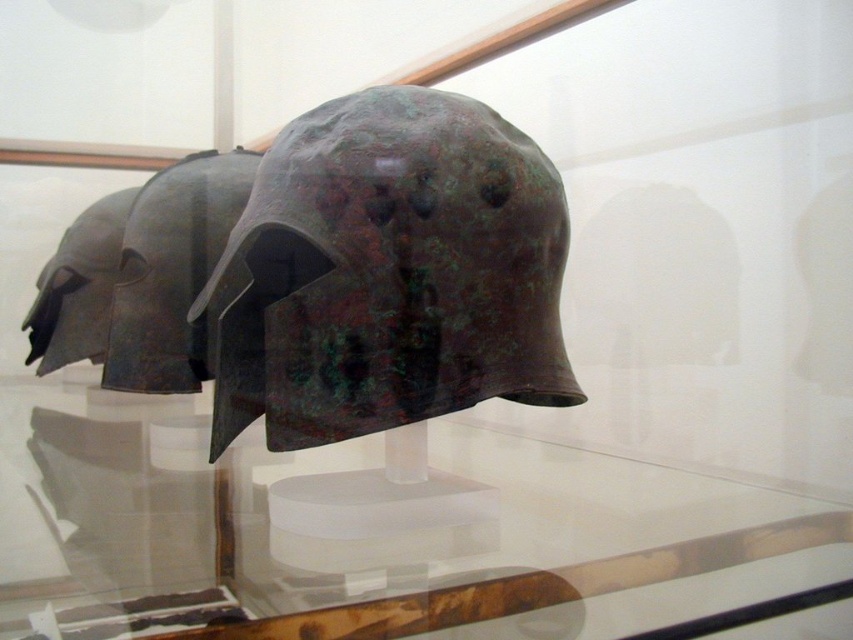
You are a museum curator standing at the entrance of the exhibition hall. You need to place a new artifact that requires a 30 inch clearance from the visitor pathway. Can the transparent glass table at center accommodate this requirement?

The transparent glass table at center is 29.93 inches away from the viewer, which is just shy of the required 30 inch clearance. Therefore, it does not meet the safety requirement for the new artifact.

You are a museum curator arranging an exhibit. You need to place a decorative banner between the transparent glass table at center and the green patina metal helmet at center. Which object should the banner be placed closer to if you want it to be visible to visitors entering from the right side of the exhibit?

The banner should be placed closer to the transparent glass table at center because it is to the left of the green patina metal helmet at center, so positioning it near the table would make it more visible to visitors entering from the right side.